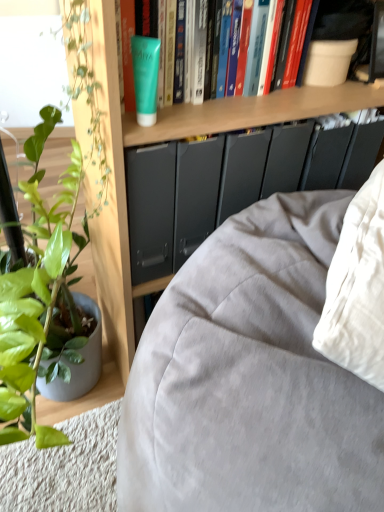
The height and width of the screenshot is (512, 384). What do you see at coordinates (172, 139) in the screenshot?
I see `wooden bookshelf at upper center` at bounding box center [172, 139].

You are a GUI agent. You are given a task and a screenshot of the screen. Output one action in this format:
    pyautogui.click(x=<x>, y=<y>)
    Task: Click on the green matte tube at upper center
    Image resolution: width=384 pixels, height=512 pixels.
    Given the screenshot: What is the action you would take?
    pyautogui.click(x=125, y=87)

Where is `green matte tube at upper center`? The image size is (384, 512). green matte tube at upper center is located at coordinates (145, 77).

Image resolution: width=384 pixels, height=512 pixels. In order to click on wooden bookshelf at upper center in this screenshot , I will do `click(172, 139)`.

Is green matte tube at upper center located within matte gray fabric couch at lower left?

No, green matte tube at upper center is not surrounded by matte gray fabric couch at lower left.

From the image's perspective, which is above, matte gray fabric couch at lower left or green matte tube at upper center?

green matte tube at upper center, from the image's perspective.

Find the location of a particular element. This screenshot has height=512, width=384. paperback book located above the matte gray fabric couch at lower left (from the image's perspective) is located at coordinates (145, 77).

Can you confirm if matte gray fabric couch at lower left is bigger than green matte tube at upper center?

Yes.

Is point (330, 390) positioned behind point (165, 46)?

No, (330, 390) is in front of (165, 46).

Based on their positions, is matte gray fabric couch at lower left located to the left or right of green matte tube at upper center?

From the image, it's evident that matte gray fabric couch at lower left is to the right of green matte tube at upper center.

Which is correct: matte gray fabric couch at lower left is inside green matte tube at upper center, or outside of it?

matte gray fabric couch at lower left is outside green matte tube at upper center.

Is wooden bookshelf at upper center in front of matte gray fabric couch at lower left?

No.

Does point (340, 110) lie behind point (366, 441)?

Yes, it is behind point (366, 441).

Is wooden bookshelf at upper center situated inside matte gray fabric couch at lower left or outside?

wooden bookshelf at upper center exists outside the volume of matte gray fabric couch at lower left.

Can you confirm if wooden bookshelf at upper center is thinner than matte gray fabric couch at lower left?

Incorrect, the width of wooden bookshelf at upper center is not less than that of matte gray fabric couch at lower left.

In terms of height, does green matte tube at upper center look taller or shorter compared to green matte tube at upper center?

Clearly, green matte tube at upper center is shorter compared to green matte tube at upper center.

Does point (139, 83) come behind point (185, 61)?

No, it is in front of (185, 61).

Considering the sizes of objects green matte tube at upper center and green matte tube at upper center in the image provided, who is bigger, green matte tube at upper center or green matte tube at upper center?

green matte tube at upper center.

From a real-world perspective, which is physically above, green matte tube at upper center or green matte tube at upper center?

From a 3D spatial view, green matte tube at upper center is above.

Consider the image. Does green matte tube at upper center have a smaller size compared to matte gray fabric couch at lower left?

Yes, green matte tube at upper center is smaller than matte gray fabric couch at lower left.

Measure the distance between green matte tube at upper center and matte gray fabric couch at lower left.

They are 40.54 centimeters apart.

Which is closer, (140, 62) or (156, 457)?

Point (140, 62) appears to be farther away from the viewer than point (156, 457).

Is green matte tube at upper center located outside matte gray fabric couch at lower left?

Yes, green matte tube at upper center is not within matte gray fabric couch at lower left.

The width and height of the screenshot is (384, 512). Find the location of `paperback book above the wooden bookshelf at upper center (from the image's perspective)`. paperback book above the wooden bookshelf at upper center (from the image's perspective) is located at coordinates (145, 77).

Could green matte tube at upper center be considered to be inside wooden bookshelf at upper center?

Yes, green matte tube at upper center is inside wooden bookshelf at upper center.

From the image's perspective, relative to green matte tube at upper center, is green matte tube at upper center above or below?

Based on their image positions, green matte tube at upper center is located above green matte tube at upper center.

Who is shorter, green matte tube at upper center or green matte tube at upper center?

With less height is green matte tube at upper center.

Visually, is green matte tube at upper center positioned to the left or to the right of green matte tube at upper center?

Clearly, green matte tube at upper center is on the right of green matte tube at upper center in the image.

I want to click on paperback book above the matte gray fabric couch at lower left (from the image's perspective), so click(145, 77).

Identify the location of studio couch in front of the green matte tube at upper center. (250, 378).

Estimate the real-world distances between objects in this image. Which object is further from green matte tube at upper center, wooden bookshelf at upper center or matte gray fabric couch at lower left?

matte gray fabric couch at lower left is further to green matte tube at upper center.

Based on their spatial positions, is green matte tube at upper center or matte gray fabric couch at lower left further from wooden bookshelf at upper center?

The object further to wooden bookshelf at upper center is matte gray fabric couch at lower left.

Considering their positions, is green matte tube at upper center positioned further to green matte tube at upper center than matte gray fabric couch at lower left?

Based on the image, matte gray fabric couch at lower left appears to be further to green matte tube at upper center.

Which object lies further to the anchor point wooden bookshelf at upper center, matte gray fabric couch at lower left or green matte tube at upper center?

Among the two, matte gray fabric couch at lower left is located further to wooden bookshelf at upper center.

Based on their spatial positions, is green matte tube at upper center or green matte tube at upper center further from wooden bookshelf at upper center?

green matte tube at upper center lies further to wooden bookshelf at upper center than the other object.

From the image, which object appears to be nearer to green matte tube at upper center, green matte tube at upper center or wooden bookshelf at upper center?

green matte tube at upper center is positioned closer to the anchor green matte tube at upper center.

In the scene shown: Looking at the image, which one is located further to wooden bookshelf at upper center, matte gray fabric couch at lower left or green matte tube at upper center?

Based on the image, matte gray fabric couch at lower left appears to be further to wooden bookshelf at upper center.

Based on their spatial positions, is matte gray fabric couch at lower left or wooden bookshelf at upper center further from green matte tube at upper center?

matte gray fabric couch at lower left is further to green matte tube at upper center.

Where is `paperback book between green matte tube at upper center and matte gray fabric couch at lower left vertically`? The width and height of the screenshot is (384, 512). paperback book between green matte tube at upper center and matte gray fabric couch at lower left vertically is located at coordinates (145, 77).

This screenshot has height=512, width=384. What are the coordinates of `bookcase between green matte tube at upper center and matte gray fabric couch at lower left in the vertical direction` in the screenshot? It's located at (172, 139).

At what (x,y) coordinates should I click in order to perform the action: click on book located between green matte tube at upper center and wooden bookshelf at upper center in the left-right direction. Please return your answer as a coordinate pair (x, y). The height and width of the screenshot is (512, 384). Looking at the image, I should click on (125, 87).

Locate an element on the screen. bookcase between green matte tube at upper center and matte gray fabric couch at lower left vertically is located at coordinates click(172, 139).